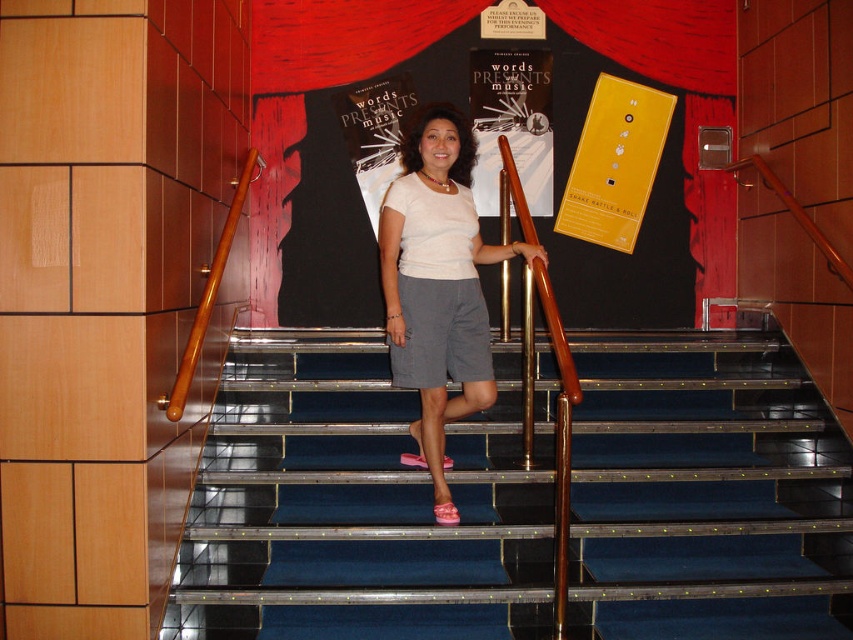
You are standing at the bottom of the staircase in the theater and want to reach the point closer to you. Which point should you head towards, point (335, 72) or point (624, 145)?

You should head towards point (335, 72) because it is closer to the viewer than point (624, 145).

You are an event planner trying to decide which poster to place higher on the staircase wall. The options are the matte black poster at upper center and the yellow matte poster at upper center. Based on their sizes, which one should you place higher to maintain visual balance?

The matte black poster at upper center is larger than the yellow matte poster at upper center. To maintain visual balance, you should place the smaller yellow matte poster at upper center higher since larger posters are typically placed lower to balance their weight in a design.

You are a visitor at the theater and want to read the matte black poster at upper center and the yellow matte poster at upper center. Which poster can you see more clearly from your current position?

The matte black poster at upper center is closer to the viewer than the yellow matte poster at upper center, so it can be seen more clearly from your current position.